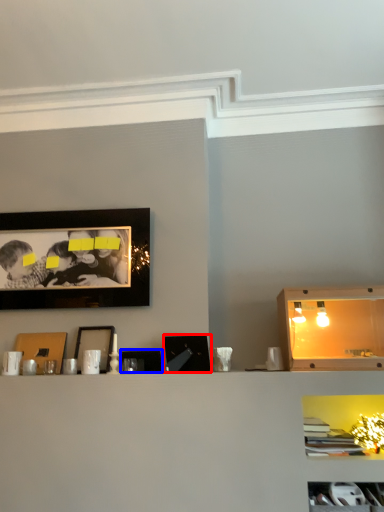
Question: Which point is further to the camera, picture frame (highlighted by a red box) or picture frame (highlighted by a blue box)?

Choices:
 (A) picture frame
 (B) picture frame

Answer: (B)